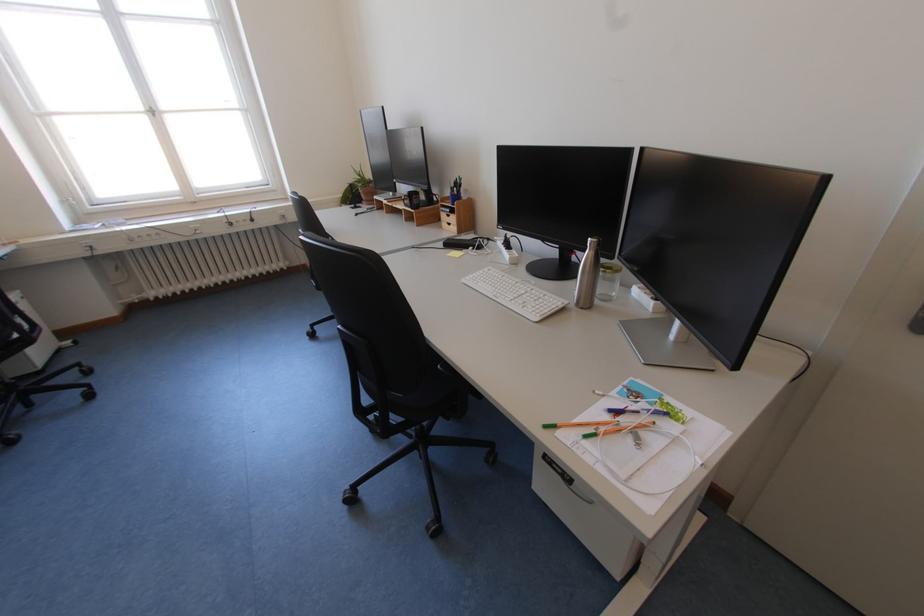
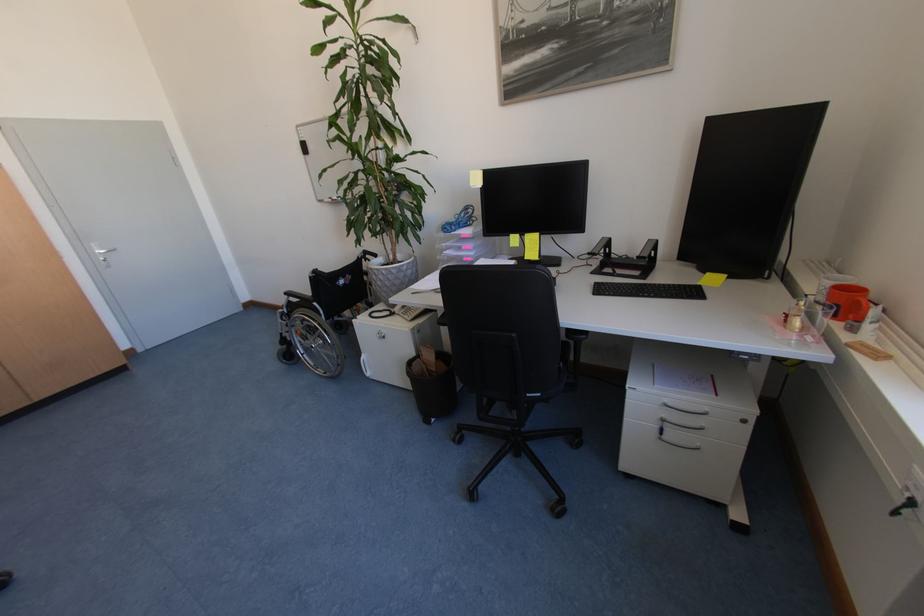
Find the pixel in the second image that matches point 30,299 in the first image.

(751, 422)